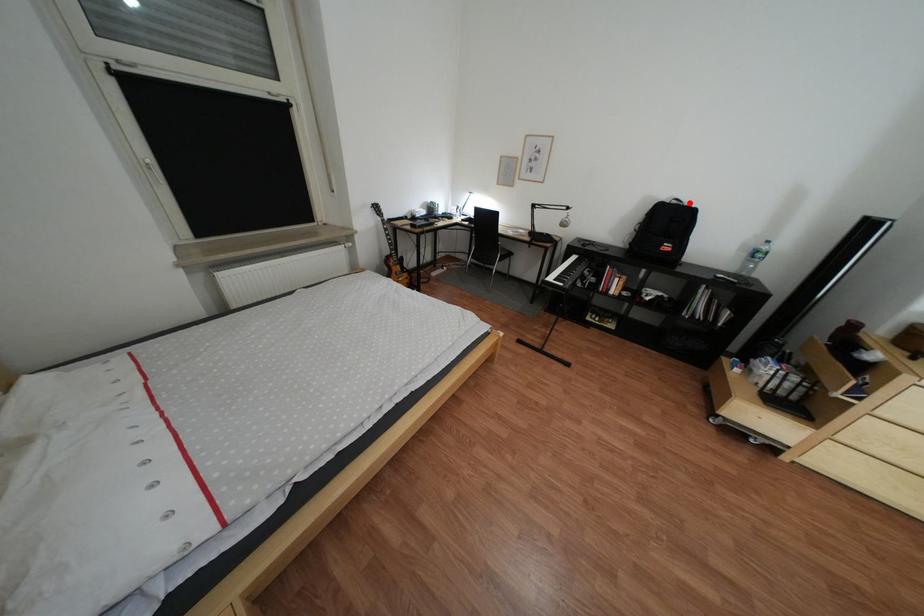
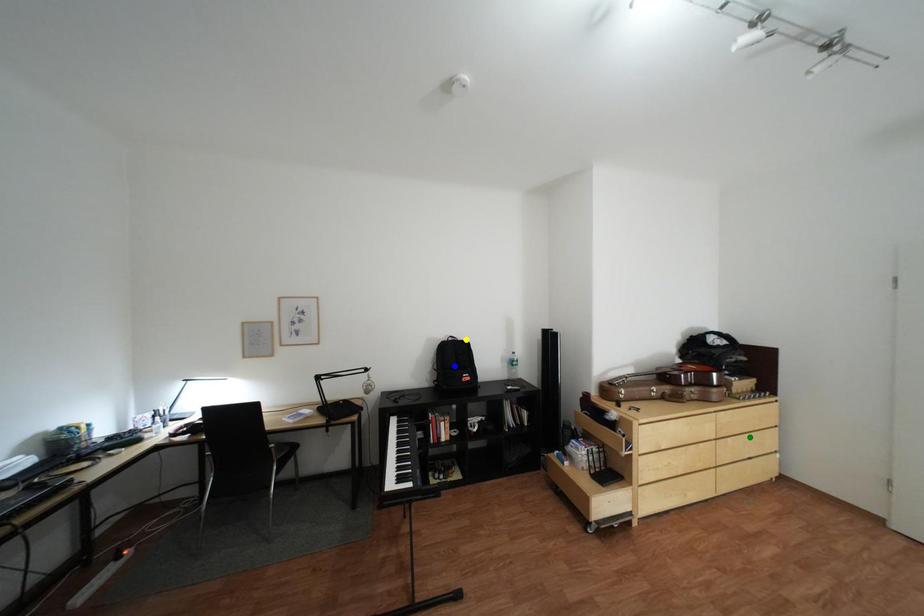
Question: I am providing you with two images of the same scene from different viewpoints. A red point is marked on the first image. You are given multiple points on the second image. Can you choose the point in image 2 that corresponds to the point in image 1?

Choices:
 (A) blue point
 (B) yellow point
 (C) green point

Answer: (B)